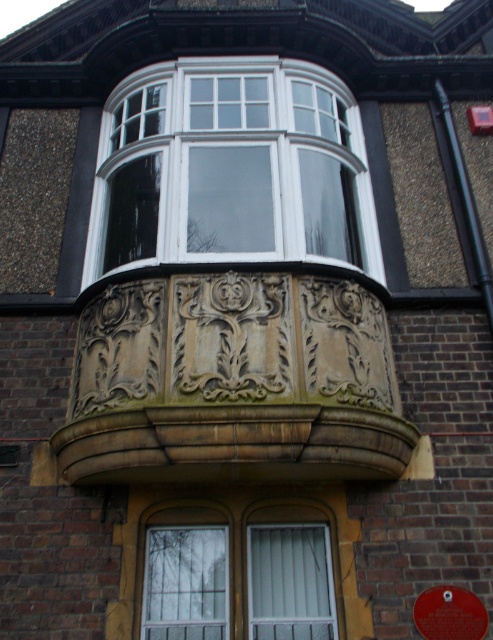
You are standing in front of a historic building and want to take a photo of the white glossy bay window at upper center. If your camera has a maximum focus range of 6 meters, will you be able to capture it clearly?

The white glossy bay window at upper center is 7.01 meters away from the camera, which exceeds the maximum focus range of 6 meters. Therefore, the camera won generated by the system. 1. The answer should be concise and factual. 2. The answer must not include any extra information beyond what is provided. 3. The answer must mention the object label from the Objects. 4. The answer must use the Objects Description to provide the correct answer. 5. The answer must be in English. 6. The answer must not reveal

You are an architect examining the building. You need to determine the spatial relationship between the carved stone balcony at center and the white glossy bay window at upper center. Which object is positioned to the right of the other?

The carved stone balcony at center is to the right of the white glossy bay window at upper center.

Consider the image. You are standing in front of the building and want to determine the spatial relationship between two points marked on the facade. Which point is closer to you, point (295, 291) or point (179, 556)?

Point (179, 556) is closer to you because the description states that point (295, 291) is behind point (179, 556).